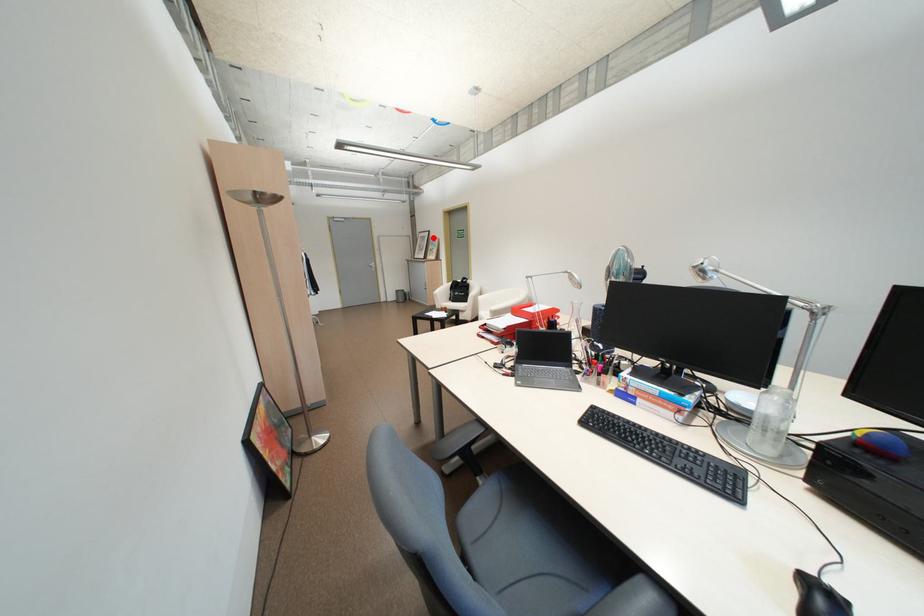
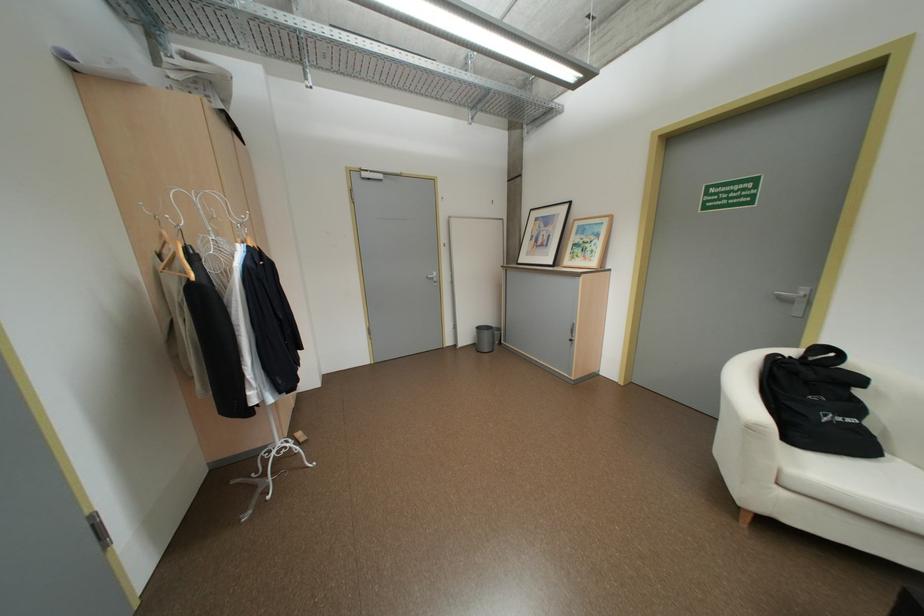
Where in the second image is the point corresponding to the highlighted location from the first image?

(556, 220)